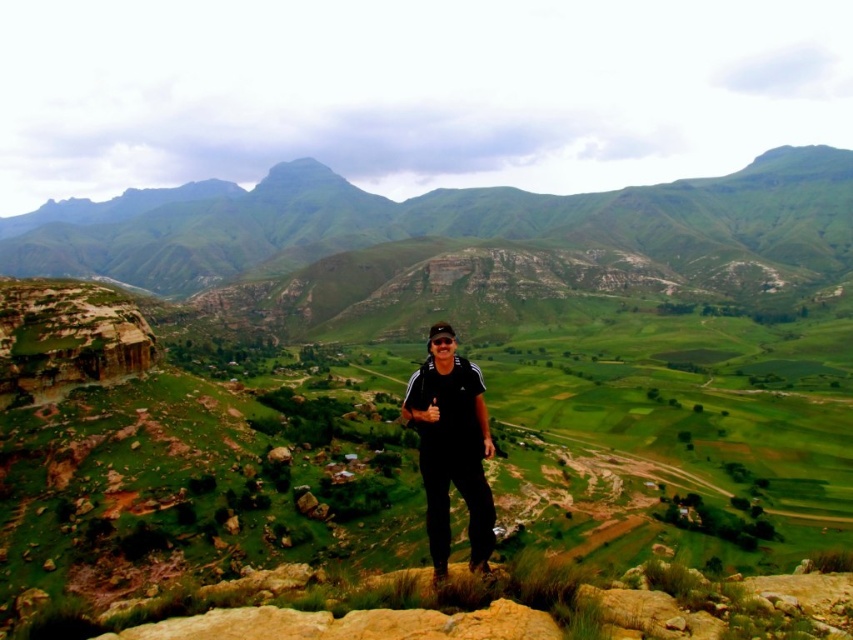
Is point (144, 276) behind point (482, 394)?

Yes.

Can you confirm if green grassy mountain at center is taller than black matte pants at center?

Yes.

Is point (614, 275) closer to viewer compared to point (424, 392)?

No, it is behind (424, 392).

Find the location of a particular element. Image resolution: width=853 pixels, height=640 pixels. green grassy mountain at center is located at coordinates (469, 241).